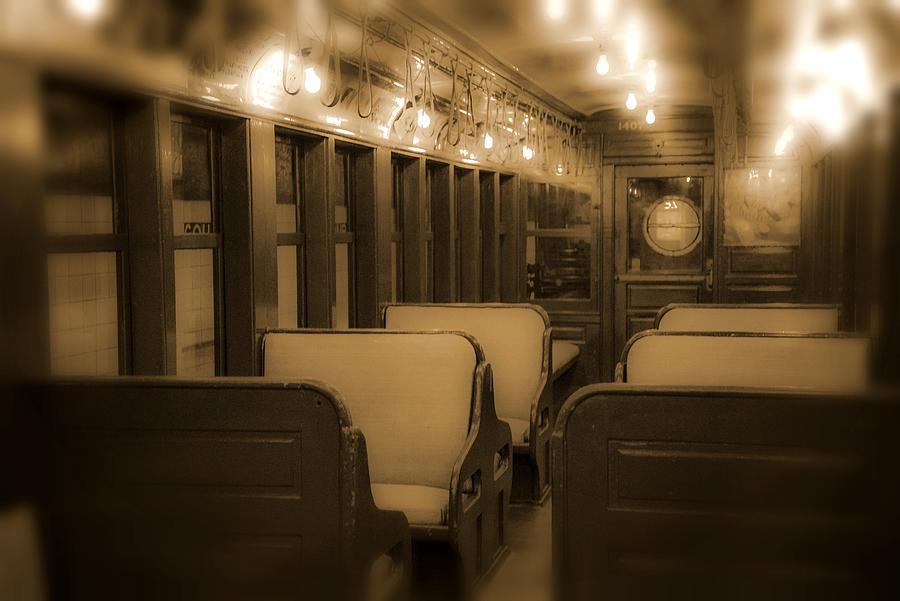
Where is `door`? door is located at coordinates (627, 311).